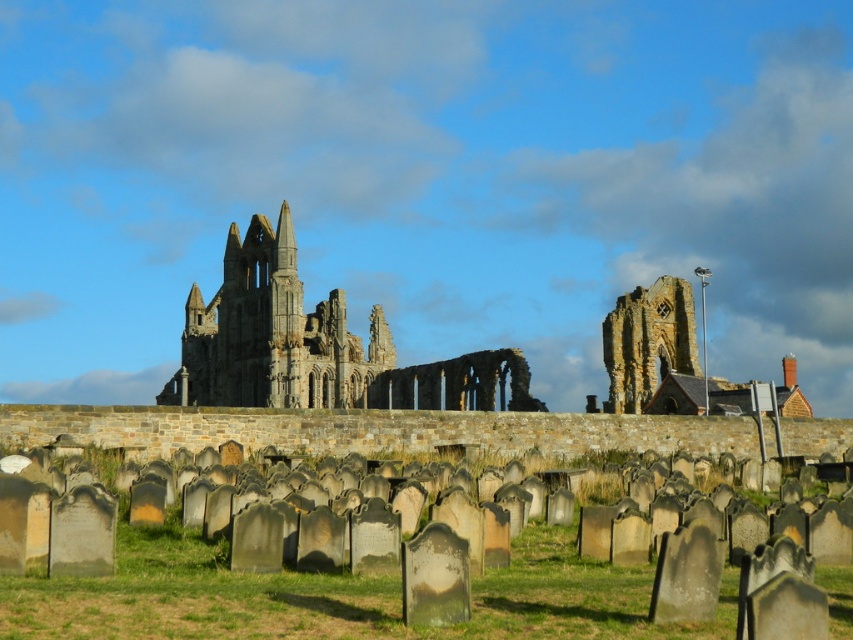
Question: Which of the following is the closest to the observer?

Choices:
 (A) green grass at lower center
 (B) stone archway at center

Answer: (A)

Question: Can you confirm if green grass at lower center is thinner than stone gothic ruins at center?

Choices:
 (A) yes
 (B) no

Answer: (A)

Question: Does green grass at lower center appear over stone gothic ruins at center?

Choices:
 (A) no
 (B) yes

Answer: (A)

Question: Does green grass at lower center have a greater width compared to stone archway at center?

Choices:
 (A) yes
 (B) no

Answer: (B)

Question: Which object appears closest to the camera in this image?

Choices:
 (A) stone archway at center
 (B) green grass at lower center

Answer: (B)

Question: Which point is closer to the camera?

Choices:
 (A) stone gothic ruins at center
 (B) stone archway at center

Answer: (B)